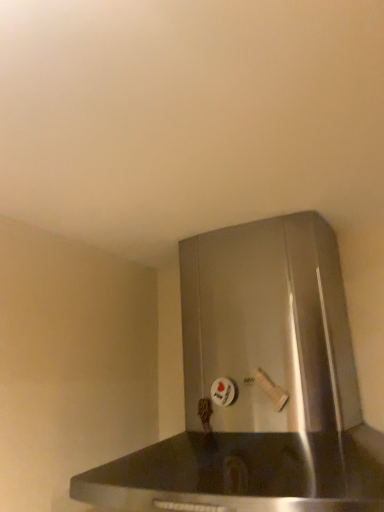
Identify the location of blank space situated above stainless steel range hood at center (from a real-world perspective). (205, 215).